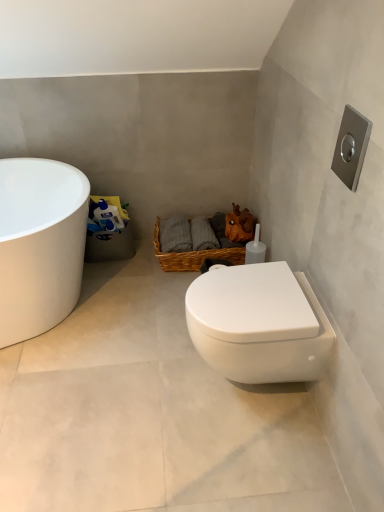
This screenshot has width=384, height=512. In order to click on free space in front of white glossy bathtub at left in this screenshot , I will do `click(77, 391)`.